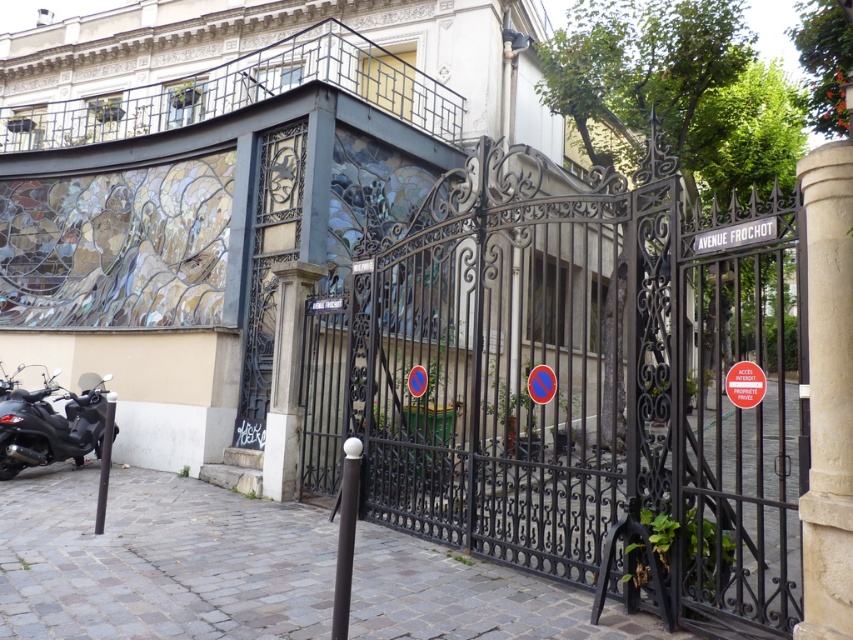
Looking at this image, can you confirm if black wrought iron gate at center is thinner than light beige stone pillar at right?

No.

Is black wrought iron gate at center above light beige stone pillar at right?

Indeed, black wrought iron gate at center is positioned over light beige stone pillar at right.

The width and height of the screenshot is (853, 640). Find the location of `black wrought iron gate at center`. black wrought iron gate at center is located at coordinates (577, 385).

This screenshot has height=640, width=853. What are the coordinates of `black wrought iron gate at center` in the screenshot? It's located at (577, 385).

Who is more distant from viewer, (282, 275) or (358, 442)?

The point (282, 275) is more distant.

Who is taller, white stone column at center or polished dark brown pole at center?

With more height is white stone column at center.

You are a GUI agent. You are given a task and a screenshot of the screen. Output one action in this format:
    pyautogui.click(x=<x>, y=<y>)
    Task: Click on the white stone column at center
    
    Given the screenshot: What is the action you would take?
    pyautogui.click(x=286, y=380)

Does polished dark brown pole at center come behind smooth black pole at lower left?

No, it is in front of smooth black pole at lower left.

Looking at this image, between polished dark brown pole at center and smooth black pole at lower left, which one appears on the right side from the viewer's perspective?

Positioned to the right is polished dark brown pole at center.

Is point (351, 540) positioned before point (105, 506)?

Yes, point (351, 540) is closer to viewer.

Find the location of a particular element. This screenshot has height=640, width=853. polished dark brown pole at center is located at coordinates (345, 536).